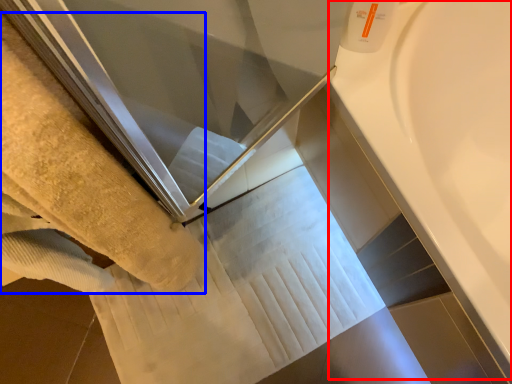
Question: Which of the following is the farthest to the observer, bath (highlighted by a red box) or towel (highlighted by a blue box)?

Choices:
 (A) bath
 (B) towel

Answer: (A)